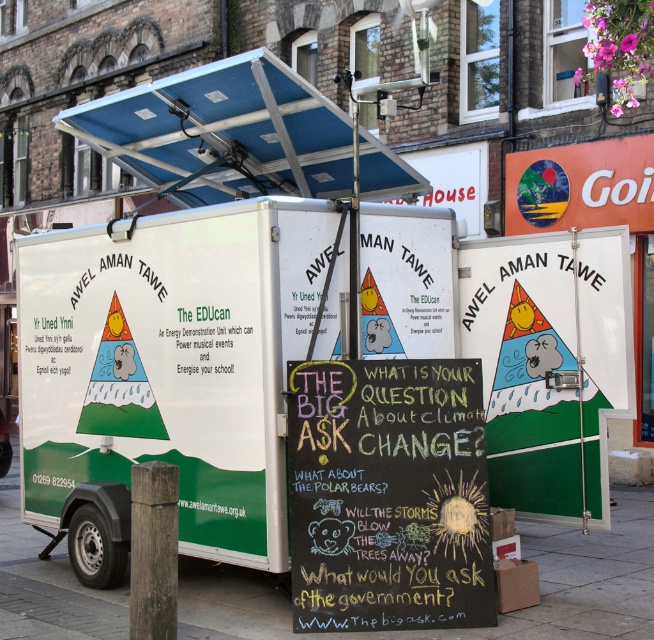
Question: Which of these objects is positioned farthest from the chalkboard at center?

Choices:
 (A) white matte sign at center
 (B) brown rough wooden post at lower left
 (C) white matte trailer at center

Answer: (A)

Question: Does chalkboard at center appear on the left side of brown rough wooden post at lower left?

Choices:
 (A) no
 (B) yes

Answer: (A)

Question: Is white matte trailer at center positioned behind blue metallic canopy at upper center?

Choices:
 (A) no
 (B) yes

Answer: (A)

Question: Estimate the real-world distances between objects in this image. Which object is closer to the blue metallic canopy at upper center?

Choices:
 (A) green concrete pavement at lower center
 (B) white matte sign at center

Answer: (B)

Question: Among these points, which one is farthest from the camera?

Choices:
 (A) (560, 586)
 (B) (192, 195)
 (C) (158, 461)
 (D) (589, 445)

Answer: (B)

Question: Is white matte trailer at center further to the viewer compared to white matte sign at center?

Choices:
 (A) yes
 (B) no

Answer: (B)